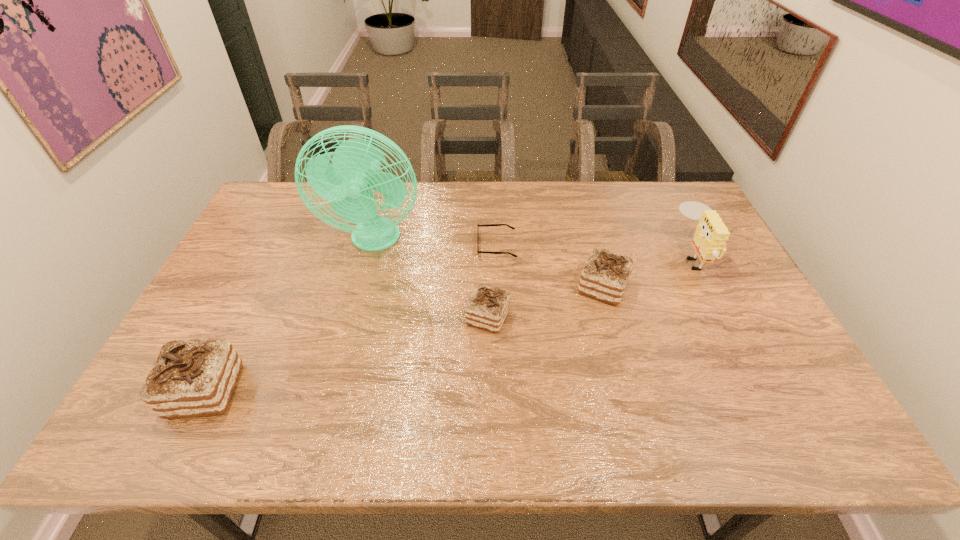
Where is `vacant region between the sunglasses and the tallest chocolate cake`? The image size is (960, 540). vacant region between the sunglasses and the tallest chocolate cake is located at coordinates (351, 318).

You are a GUI agent. You are given a task and a screenshot of the screen. Output one action in this format:
    pyautogui.click(x=<x>, y=<y>)
    Task: Click on the free space that is in between the second object from left to right and the sponge
    
    Given the screenshot: What is the action you would take?
    pyautogui.click(x=534, y=248)

At what (x,y) coordinates should I click in order to perform the action: click on vacant point located between the third shortest object and the fourth shortest object. Please return your answer as a coordinate pair (x, y). The image size is (960, 540). Looking at the image, I should click on (404, 339).

Find the location of a particular element. vacant area that lies between the second object from left to right and the fourth tallest object is located at coordinates (489, 264).

I want to click on vacant point located between the tallest object and the third shortest object, so click(x=489, y=264).

The width and height of the screenshot is (960, 540). In order to click on vacant area between the fifth object from right to left and the rightmost object in this screenshot , I will do `click(534, 248)`.

Image resolution: width=960 pixels, height=540 pixels. In order to click on free space between the third shortest object and the nearest chocolate cake in this screenshot , I will do `click(404, 339)`.

Locate an element on the screen. Image resolution: width=960 pixels, height=540 pixels. unoccupied position between the second tallest chocolate cake and the second chocolate cake from left to right is located at coordinates (545, 302).

Identify the location of free space between the shortest object and the leftmost object. This screenshot has width=960, height=540. (351, 318).

Where is `vacant region between the shortest chocolate cake and the shortest object`? This screenshot has width=960, height=540. vacant region between the shortest chocolate cake and the shortest object is located at coordinates point(492,281).